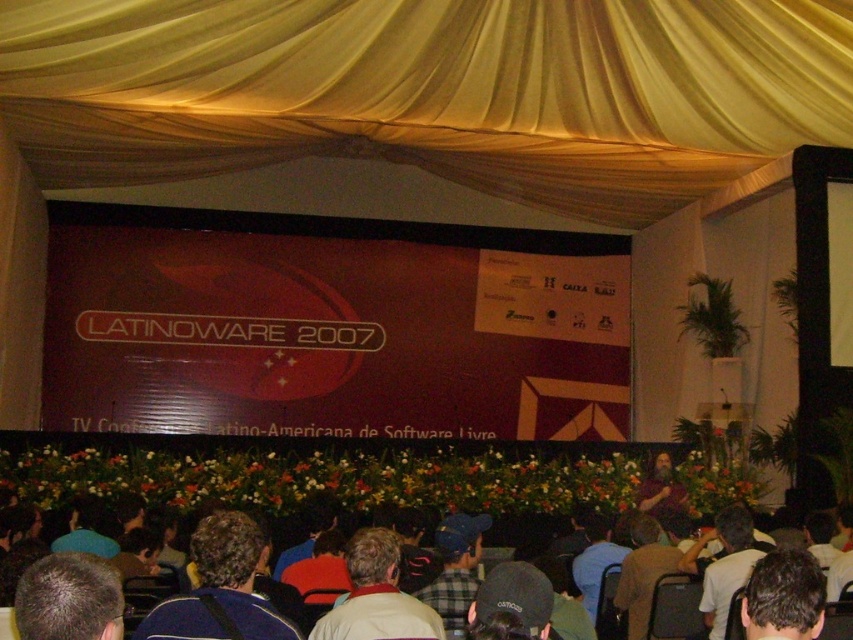
This screenshot has height=640, width=853. Find the location of `dark brown hair at lower left`. dark brown hair at lower left is located at coordinates (68, 598).

Is dark brown hair at lower left to the right of black fabric cap at lower center from the viewer's perspective?

Incorrect, dark brown hair at lower left is not on the right side of black fabric cap at lower center.

At what (x,y) coordinates should I click in order to perform the action: click on dark brown hair at lower left. Please return your answer as a coordinate pair (x, y). The image size is (853, 640). Looking at the image, I should click on tap(68, 598).

Locate an element on the screen. dark brown hair at lower left is located at coordinates (68, 598).

In the scene shown: Can you confirm if blue fabric at lower left is wider than light brown fabric jacket at lower center?

Yes.

This screenshot has height=640, width=853. What do you see at coordinates (219, 588) in the screenshot?
I see `blue fabric at lower left` at bounding box center [219, 588].

The height and width of the screenshot is (640, 853). What are the coordinates of `blue fabric at lower left` in the screenshot? It's located at tap(219, 588).

Is blue fabric at lower left closer to the viewer compared to dark brown hair at lower left?

No.

Is point (190, 550) in front of point (67, 586)?

No, (190, 550) is further to viewer.

Who is more distant from viewer, (177, 614) or (44, 557)?

The point (177, 614) is behind.

Where is `blue fabric at lower left`? blue fabric at lower left is located at coordinates (219, 588).